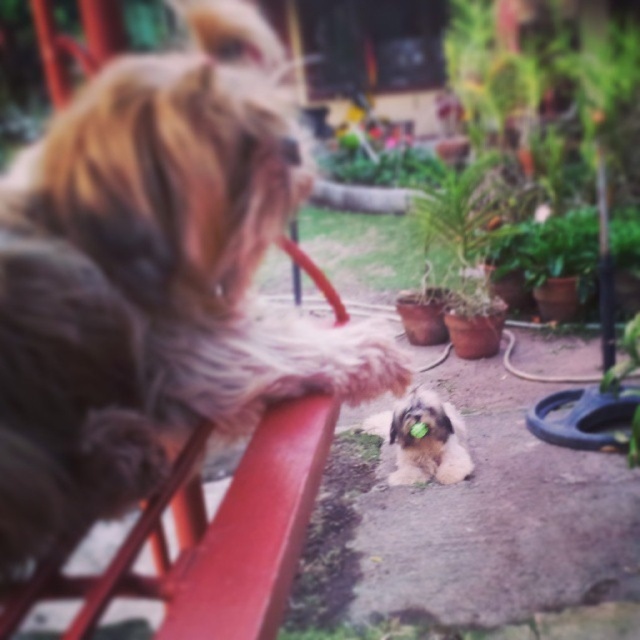
Question: Which of the following is the closest to the observer?

Choices:
 (A) (634, 432)
 (B) (198, 248)
 (C) (412, 177)

Answer: (B)

Question: Which object is positioned closest to the fuzzy brown dog at upper left?

Choices:
 (A) green leafy plant at lower right
 (B) fluffy white dog at center
 (C) green leafy plant at center

Answer: (B)

Question: Which of the following is the farthest from the observer?

Choices:
 (A) green leafy plant at lower right
 (B) fuzzy brown dog at upper left
 (C) fluffy white dog at center

Answer: (C)

Question: Is fluffy white dog at center positioned before green leafy plant at center?

Choices:
 (A) yes
 (B) no

Answer: (A)

Question: Observing the image, what is the correct spatial positioning of fuzzy brown dog at upper left in reference to green leafy plant at lower right?

Choices:
 (A) below
 (B) above

Answer: (B)

Question: Is fluffy white dog at center smaller than green leafy plant at lower right?

Choices:
 (A) yes
 (B) no

Answer: (A)